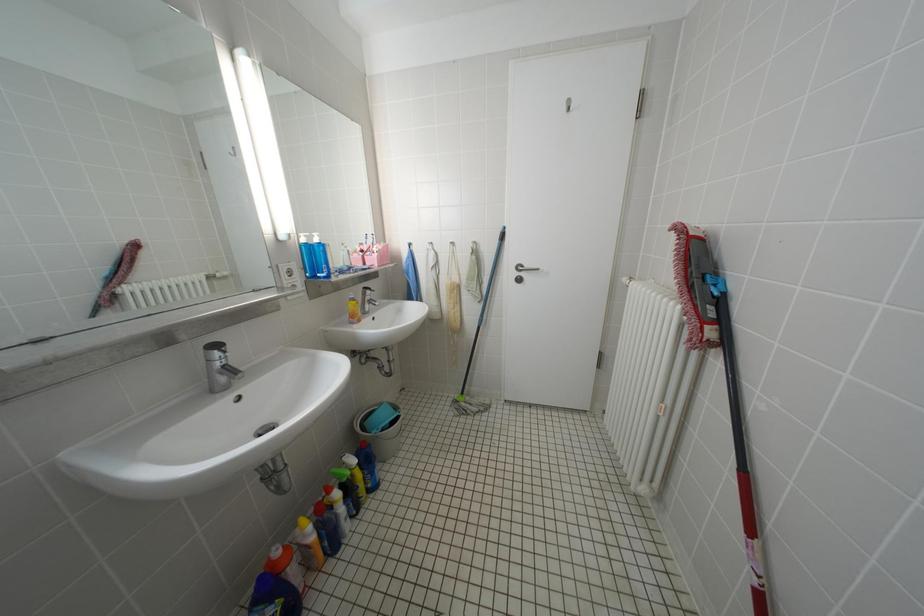
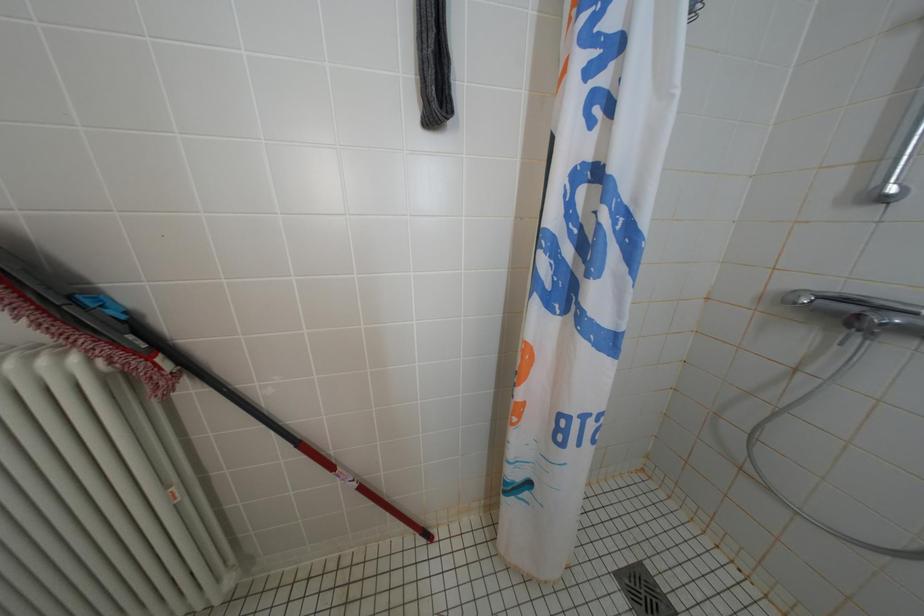
First-person continuous shooting, in which direction is the camera rotating?

The rotation direction of the camera is right-down.